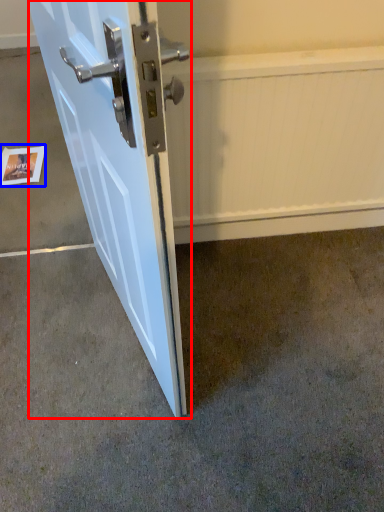
Question: Which point is closer to the camera, door (highlighted by a red box) or postcard (highlighted by a blue box)?

Choices:
 (A) door
 (B) postcard

Answer: (A)